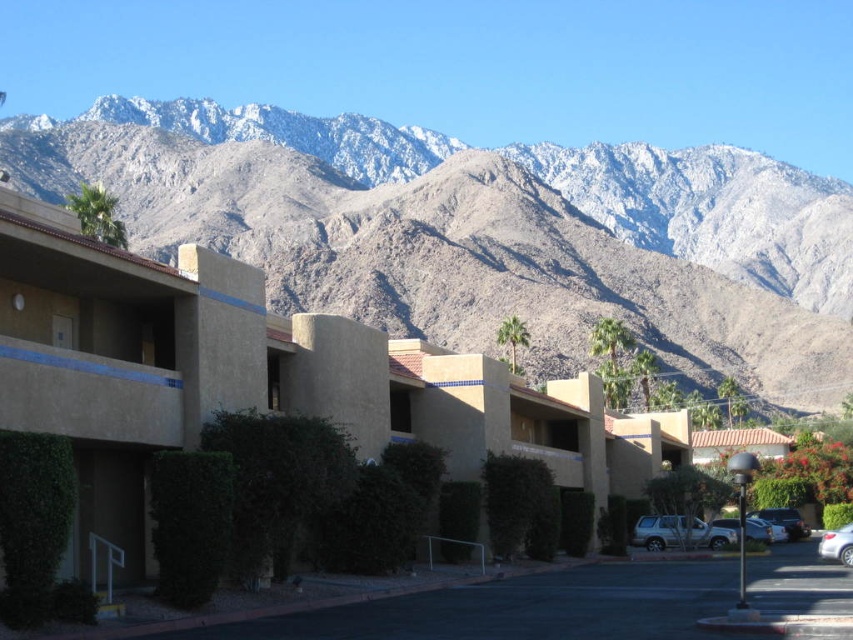
Is gray rocky mountain range at upper center to the left of green leafy hedge at lower left from the viewer's perspective?

Incorrect, gray rocky mountain range at upper center is not on the left side of green leafy hedge at lower left.

Is point (143, 224) farther from viewer compared to point (175, 525)?

Yes, it is behind point (175, 525).

Locate an element on the screen. The image size is (853, 640). gray rocky mountain range at upper center is located at coordinates (436, 252).

Based on the photo, between matte silver suv at center and white glossy sedan at lower right, which one has more height?

white glossy sedan at lower right is taller.

Which is below, matte silver suv at center or white glossy sedan at lower right?

matte silver suv at center is lower down.

This screenshot has height=640, width=853. What do you see at coordinates (679, 532) in the screenshot?
I see `matte silver suv at center` at bounding box center [679, 532].

Locate an element on the screen. Image resolution: width=853 pixels, height=640 pixels. matte silver suv at center is located at coordinates (679, 532).

Does gray rocky mountain range at upper center appear on the left side of white glossy sedan at lower right?

Correct, you'll find gray rocky mountain range at upper center to the left of white glossy sedan at lower right.

Is point (469, 308) less distant than point (849, 534)?

No, it is not.

Is point (202, 241) positioned behind point (822, 536)?

Yes, point (202, 241) is farther from viewer.

At what (x,y) coordinates should I click in order to perform the action: click on gray rocky mountain range at upper center. Please return your answer as a coordinate pair (x, y). The image size is (853, 640). Looking at the image, I should click on (436, 252).